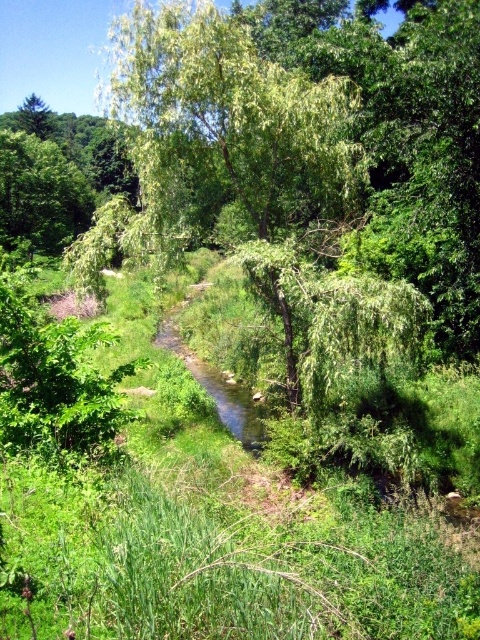
In the scene shown: Who is shorter, green leafy grass at center or clear water stream at center?

With less height is green leafy grass at center.

Is point (184, 624) positioned behind point (197, 376)?

That is False.

Locate an element on the screen. green leafy grass at center is located at coordinates (211, 538).

Between green leafy tree at center and clear water stream at center, which one has more height?

green leafy tree at center

Does green leafy tree at center have a smaller size compared to clear water stream at center?

Actually, green leafy tree at center might be larger than clear water stream at center.

The width and height of the screenshot is (480, 640). Describe the element at coordinates (226, 152) in the screenshot. I see `green leafy tree at center` at that location.

Find the location of a particular element. This screenshot has height=640, width=480. green leafy tree at center is located at coordinates (226, 152).

Is green leafy grass at center positioned in front of green leafy tree at center?

Yes, it is in front of green leafy tree at center.

Who is positioned more to the left, green leafy grass at center or green leafy tree at center?

green leafy grass at center

Does point (189, 504) come closer to viewer compared to point (256, 282)?

Yes, point (189, 504) is in front of point (256, 282).

At what (x,y) coordinates should I click in order to perform the action: click on green leafy grass at center. Please return your answer as a coordinate pair (x, y). Looking at the image, I should click on coord(211,538).